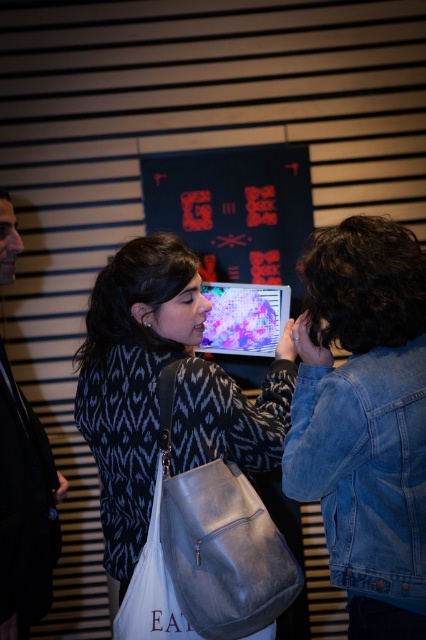
Question: Does matte black sweater at center come in front of leather bag at center?

Choices:
 (A) no
 (B) yes

Answer: (A)

Question: Considering the real-world distances, which object is farthest from the black leather jacket at left?

Choices:
 (A) matte plastic screen at center
 (B) matte black sweater at center
 (C) leather bag at center

Answer: (A)

Question: Which point is closer to the camera?

Choices:
 (A) matte plastic screen at center
 (B) matte black sweater at center

Answer: (B)

Question: Among these points, which one is nearest to the camera?

Choices:
 (A) (126, 532)
 (B) (233, 545)

Answer: (B)

Question: Does leather bag at center lie behind matte plastic screen at center?

Choices:
 (A) no
 (B) yes

Answer: (A)

Question: Can you confirm if leather bag at center is bigger than black leather jacket at left?

Choices:
 (A) yes
 (B) no

Answer: (B)